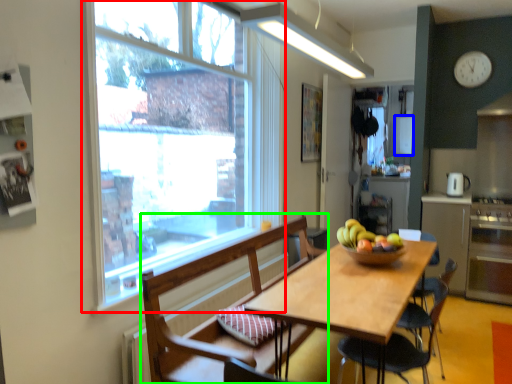
Question: Based on their relative distances, which object is nearer to window (highlighted by a red box)? Choose from appliance (highlighted by a blue box) and chair (highlighted by a green box).

Choices:
 (A) appliance
 (B) chair

Answer: (B)